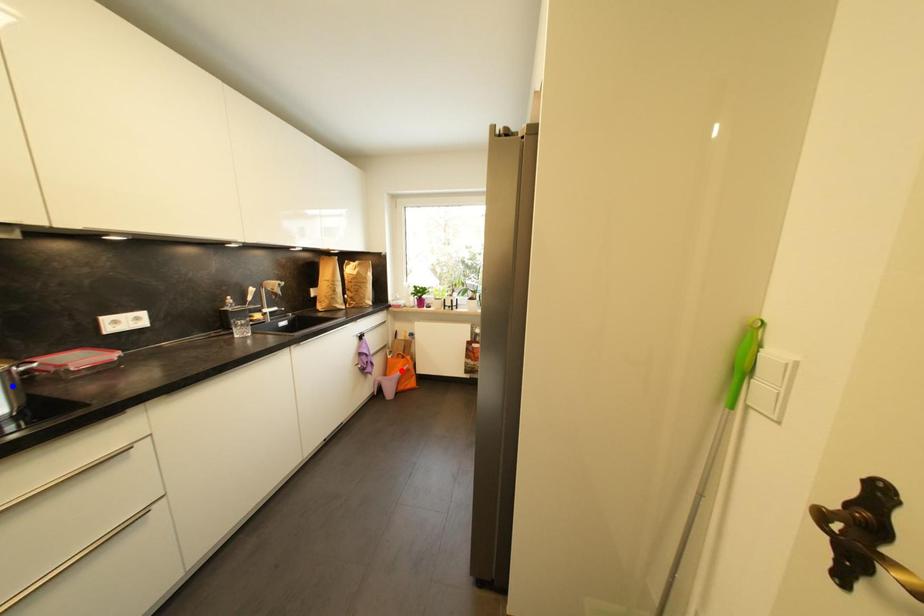
Question: In the image, two points are highlighted. Which point is nearer to the camera? Reply with the corresponding letter.

Choices:
 (A) blue point
 (B) red point

Answer: (A)